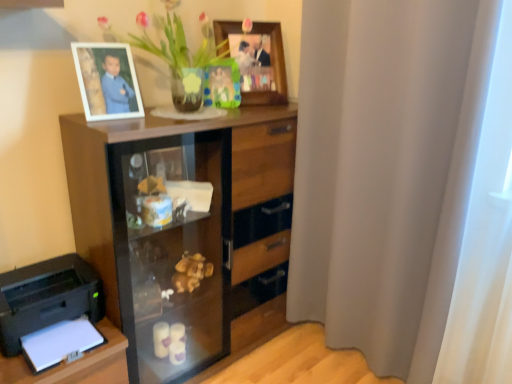
Question: Does black plastic printer at lower left have a lesser width compared to translucent glass vase at upper center?

Choices:
 (A) yes
 (B) no

Answer: (A)

Question: From the image's perspective, does black plastic printer at lower left appear higher than translucent glass vase at upper center?

Choices:
 (A) no
 (B) yes

Answer: (A)

Question: Can you confirm if black plastic printer at lower left is positioned to the left of translucent glass vase at upper center?

Choices:
 (A) no
 (B) yes

Answer: (B)

Question: From a real-world perspective, is black plastic printer at lower left over translucent glass vase at upper center?

Choices:
 (A) no
 (B) yes

Answer: (A)

Question: Is black plastic printer at lower left to the right of translucent glass vase at upper center from the viewer's perspective?

Choices:
 (A) no
 (B) yes

Answer: (A)

Question: In the image, is wooden picture frame at upper center, placed as the second picture frame when sorted from back to front, positioned in front of or behind green matte picture frame at upper center, arranged as the 3th picture frame when viewed from the front?

Choices:
 (A) front
 (B) behind

Answer: (A)

Question: Based on their positions, is wooden picture frame at upper center, the first picture frame viewed from the right, located to the left or right of green matte picture frame at upper center, arranged as the 3th picture frame when viewed from the front?

Choices:
 (A) right
 (B) left

Answer: (A)

Question: Considering the positions of wooden picture frame at upper center, marked as the 2th picture frame in a front-to-back arrangement, and green matte picture frame at upper center, placed as the first picture frame when sorted from back to front, in the image, is wooden picture frame at upper center, marked as the 2th picture frame in a front-to-back arrangement, wider or thinner than green matte picture frame at upper center, placed as the first picture frame when sorted from back to front,?

Choices:
 (A) wide
 (B) thin

Answer: (A)

Question: In terms of height, does wooden picture frame at upper center, marked as the 2th picture frame in a front-to-back arrangement, look taller or shorter compared to green matte picture frame at upper center, placed as the first picture frame when sorted from back to front?

Choices:
 (A) tall
 (B) short

Answer: (A)

Question: Is white fabric curtain at right bigger or smaller than black plastic printer at lower left?

Choices:
 (A) big
 (B) small

Answer: (A)

Question: From the image's perspective, is white fabric curtain at right above or below black plastic printer at lower left?

Choices:
 (A) above
 (B) below

Answer: (A)

Question: Is white fabric curtain at right to the left or to the right of black plastic printer at lower left in the image?

Choices:
 (A) left
 (B) right

Answer: (B)

Question: Is white fabric curtain at right in front of or behind black plastic printer at lower left in the image?

Choices:
 (A) behind
 (B) front

Answer: (B)

Question: Is wooden cabinet at center bigger or smaller than white fabric curtain at right?

Choices:
 (A) big
 (B) small

Answer: (A)

Question: Would you say wooden cabinet at center is to the left or to the right of white fabric curtain at right in the picture?

Choices:
 (A) left
 (B) right

Answer: (A)